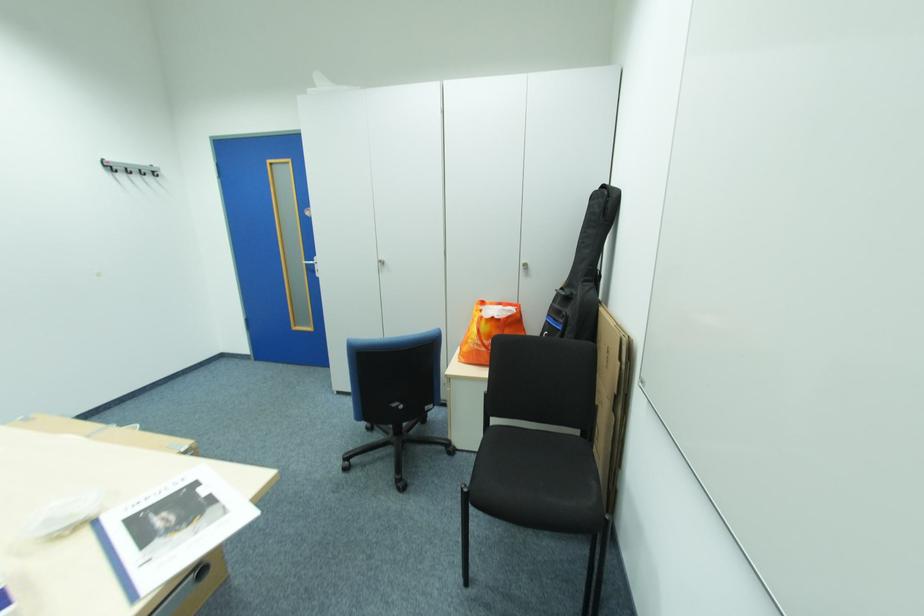
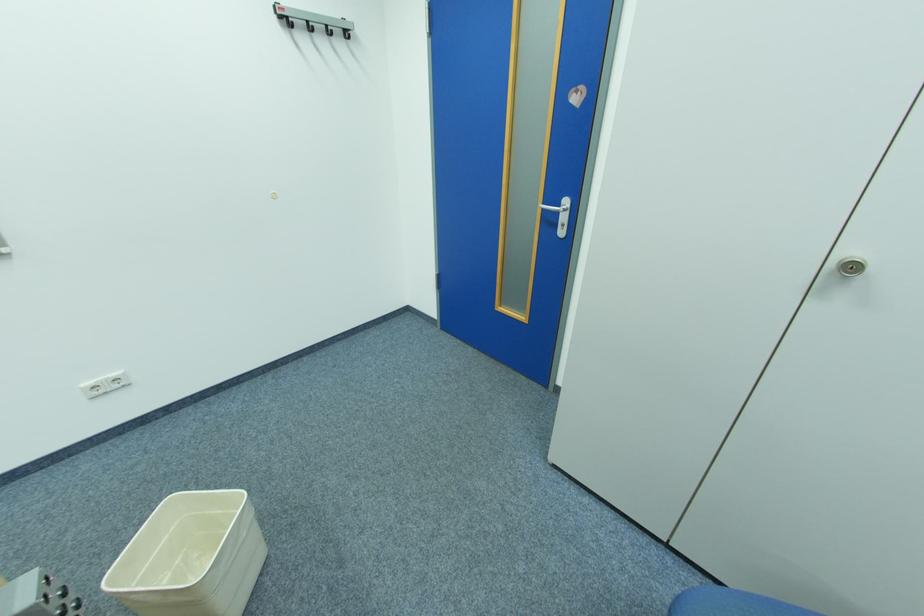
The point at (314, 265) is marked in the first image. Where is the corresponding point in the second image?

(552, 209)